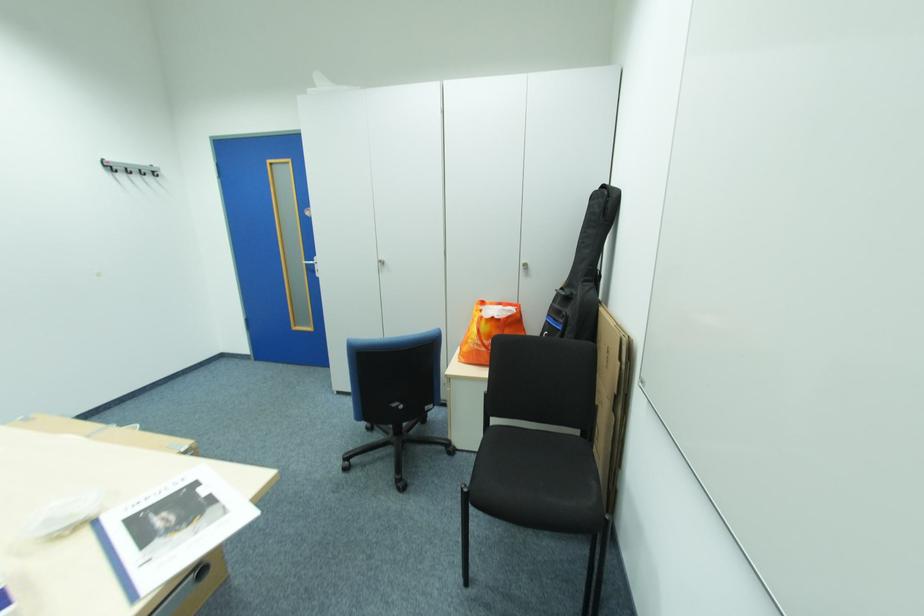
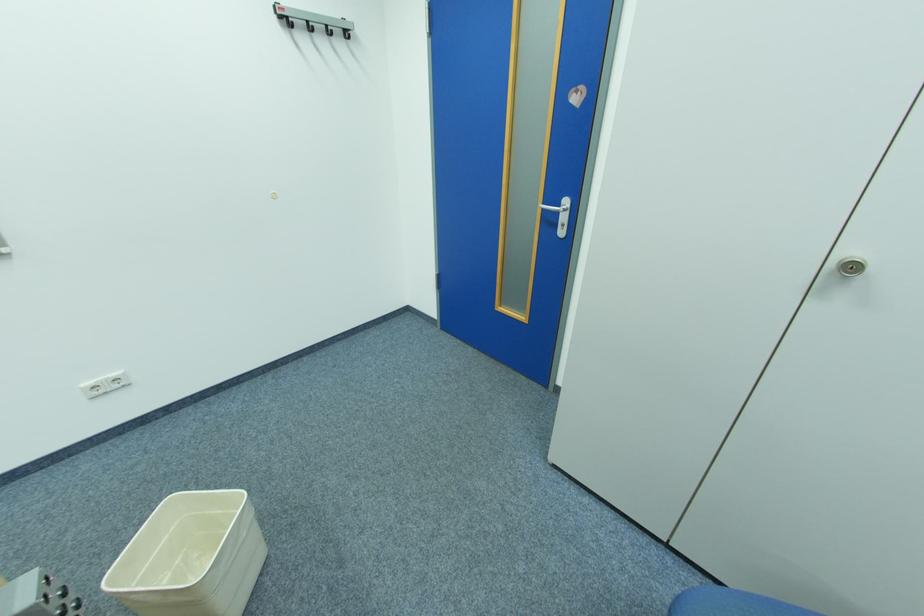
The point at (314, 265) is marked in the first image. Where is the corresponding point in the second image?

(552, 209)